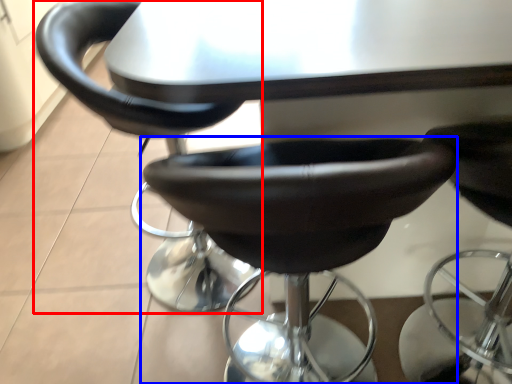
Question: Among these objects, which one is nearest to the camera, chair (highlighted by a red box) or chair (highlighted by a blue box)?

Choices:
 (A) chair
 (B) chair

Answer: (B)